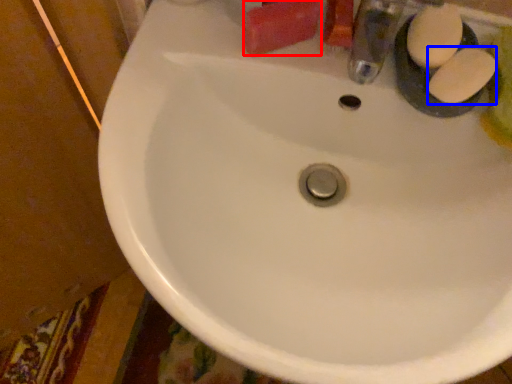
Question: Among these objects, which one is nearest to the camera, soap (highlighted by a red box) or soap (highlighted by a blue box)?

Choices:
 (A) soap
 (B) soap

Answer: (B)